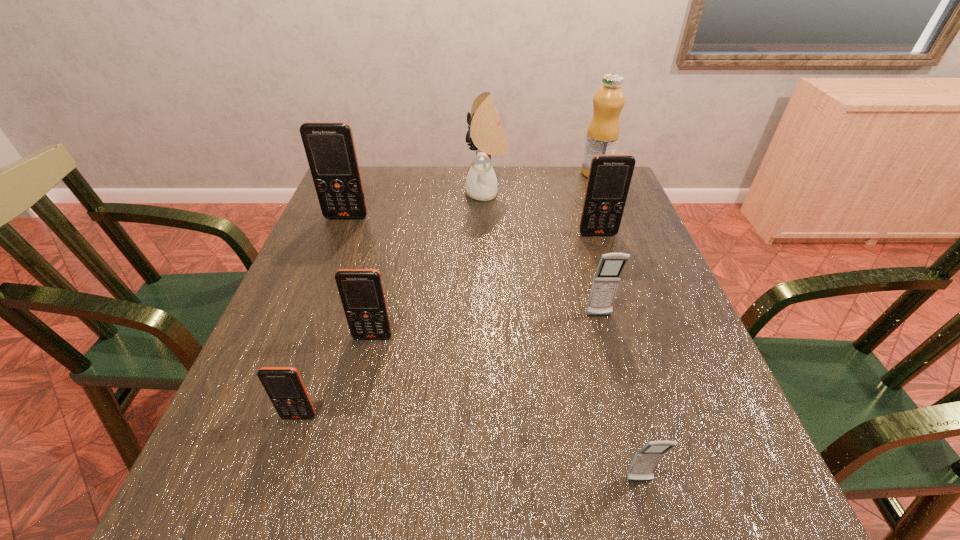
Where is `vacant space located 0.300m at the front face of the doll`? The width and height of the screenshot is (960, 540). vacant space located 0.300m at the front face of the doll is located at coordinates (364, 193).

Where is `vacant space located on the screen of the farthest cellular telephone`? The height and width of the screenshot is (540, 960). vacant space located on the screen of the farthest cellular telephone is located at coordinates (303, 328).

Image resolution: width=960 pixels, height=540 pixels. I want to click on vacant space located on the screen of the third smallest orange cellular telephone, so click(626, 319).

Locate an element on the screen. The image size is (960, 540). vacant space situated 0.350m on the front-facing side of the fourth nearest cellular telephone is located at coordinates (646, 488).

At what (x,y) coordinates should I click in order to perform the action: click on blank space located on the screen of the third orange cellular telephone from left to right. Please return your answer as a coordinate pair (x, y). Looking at the image, I should click on (364, 374).

The width and height of the screenshot is (960, 540). In order to click on vacant point located 0.140m on the screen of the nearest orange cellular telephone in this screenshot , I will do `click(269, 506)`.

At what (x,y) coordinates should I click in order to perform the action: click on fruit juice present at the far edge. Please return your answer as a coordinate pair (x, y). This screenshot has width=960, height=540. Looking at the image, I should click on (603, 131).

Find the location of a particular element. Image resolution: width=960 pixels, height=540 pixels. doll that is positioned at the far edge is located at coordinates (487, 138).

The width and height of the screenshot is (960, 540). What are the coordinates of `object situated at the near edge` in the screenshot? It's located at (646, 460).

The image size is (960, 540). In order to click on fruit juice positioned at the right edge in this screenshot , I will do `click(603, 131)`.